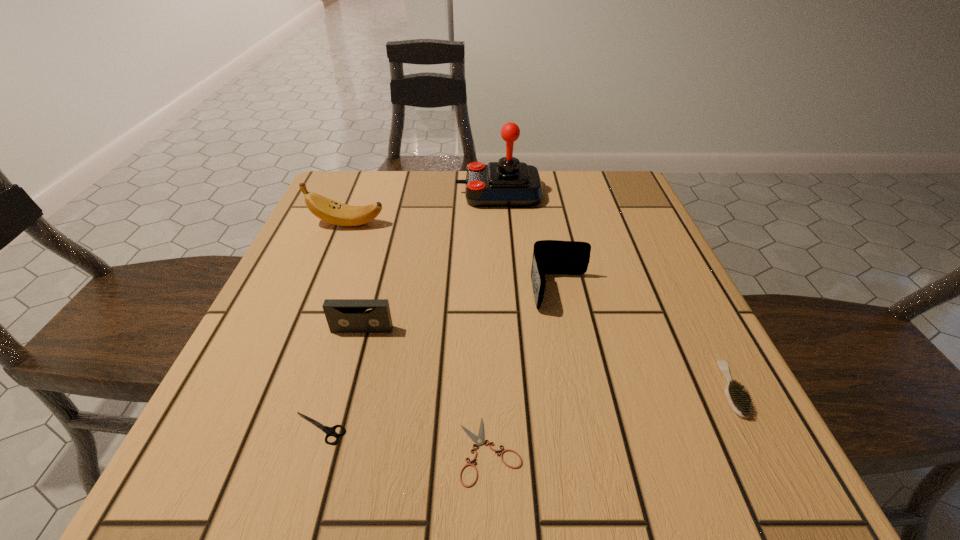
Where is `unoccupied position between the farthest object and the third farthest object`? unoccupied position between the farthest object and the third farthest object is located at coordinates (530, 242).

In order to click on vacant space in between the videotape and the left shears in this screenshot , I will do `click(341, 379)`.

Find the location of a particular element. vacant area that lies between the fourth nearest object and the wallet is located at coordinates (462, 310).

Find the location of a particular element. The width and height of the screenshot is (960, 540). vacant space in between the second shortest object and the fourth nearest object is located at coordinates (341, 379).

Locate an element on the screen. vacant space that is in between the farthest object and the second farthest object is located at coordinates (423, 208).

Where is `empty location between the fourth nearest object and the joystick`? empty location between the fourth nearest object and the joystick is located at coordinates (430, 261).

What are the coordinates of `empty location between the videotape and the second shortest object` in the screenshot? It's located at (341, 379).

Identify which object is located as the sixth nearest to the shorter shears. Please provide its 2D coordinates. Your answer should be formatted as a tuple, i.e. [(x, y)], where the tuple contains the x and y coordinates of a point satisfying the conditions above.

[(507, 183)]

You are a GUI agent. You are given a task and a screenshot of the screen. Output one action in this format:
    pyautogui.click(x=<x>, y=<y>)
    Task: Click on the object that is the second closest to the third farthest object
    
    Given the screenshot: What is the action you would take?
    pyautogui.click(x=479, y=440)

I want to click on free spot that satisfies the following two spatial constraints: 1. on the front-facing side of the videotape; 2. on the right side of the third shortest object, so click(346, 389).